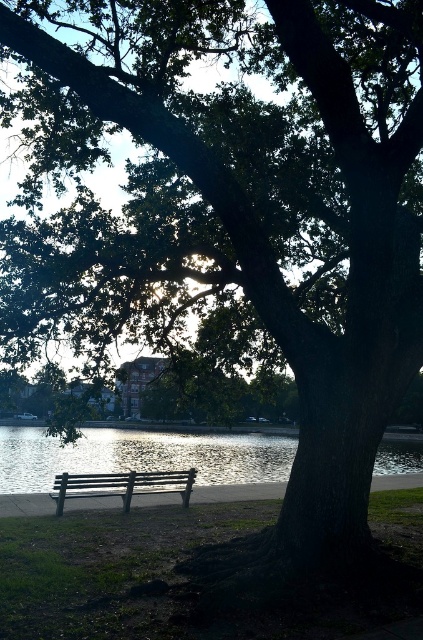
You are sitting on the wooden bench under the large tree. To your left, there is a point marked at coordinates (140, 456). What can you see at that point?

At point (140, 456) lies glistening water at bench left.

You are standing at the point with coordinates point [106,493] and want to walk towards the point with coordinates point [41,476]. Will you be moving towards the tree or away from it?

Since point [41,476] is behind point [106,493], moving towards it would mean walking away from the tree.